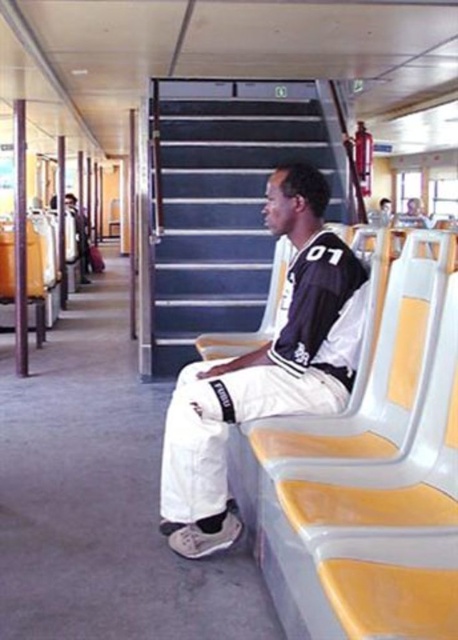
Question: Does white matte pants at center appear on the right side of matte black shirt at center?

Choices:
 (A) yes
 (B) no

Answer: (A)

Question: Which of the following is the closest to the observer?

Choices:
 (A) matte black shirt at center
 (B) white matte pants at center

Answer: (B)

Question: Is white matte pants at center to the right of matte black shirt at center from the viewer's perspective?

Choices:
 (A) yes
 (B) no

Answer: (A)

Question: Which of the following is the closest to the observer?

Choices:
 (A) white matte pants at center
 (B) matte black shirt at center

Answer: (A)

Question: Is white matte pants at center closer to the viewer compared to matte black shirt at center?

Choices:
 (A) no
 (B) yes

Answer: (B)